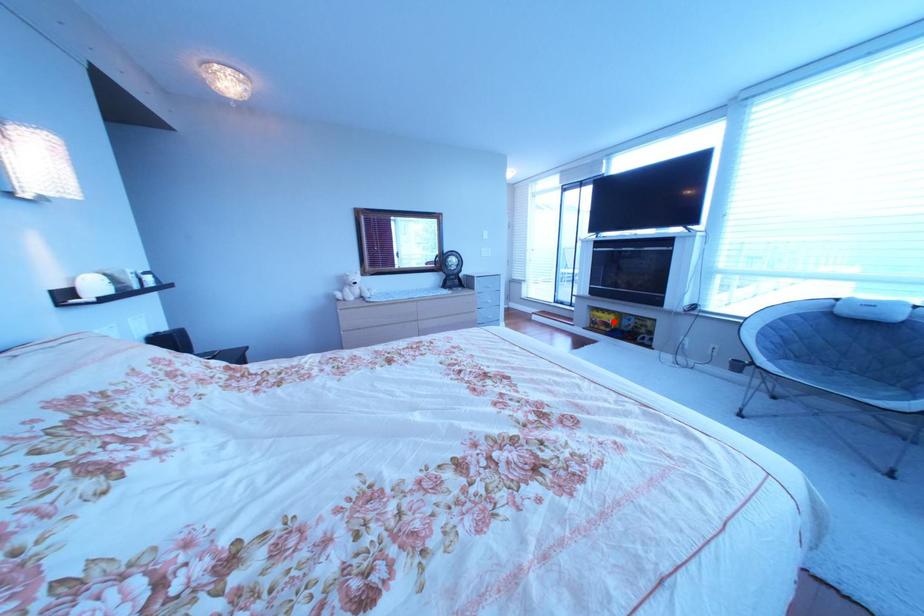
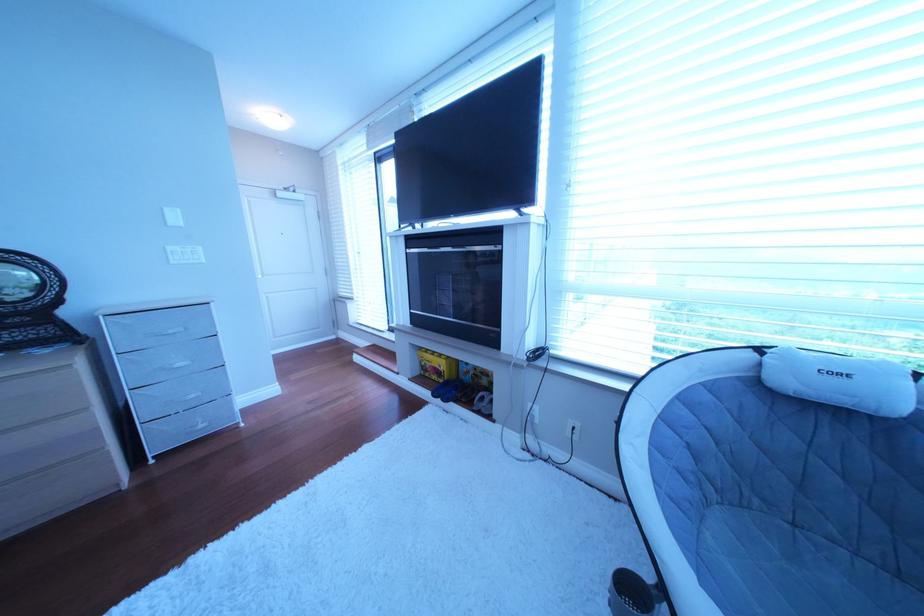
Question: I am providing you with two images of the same scene from different viewpoints. A red point is shown in image1. For the corresponding object point in image2, is it positioned nearer or farther from the camera?

Choices:
 (A) Nearer
 (B) Farther

Answer: (B)